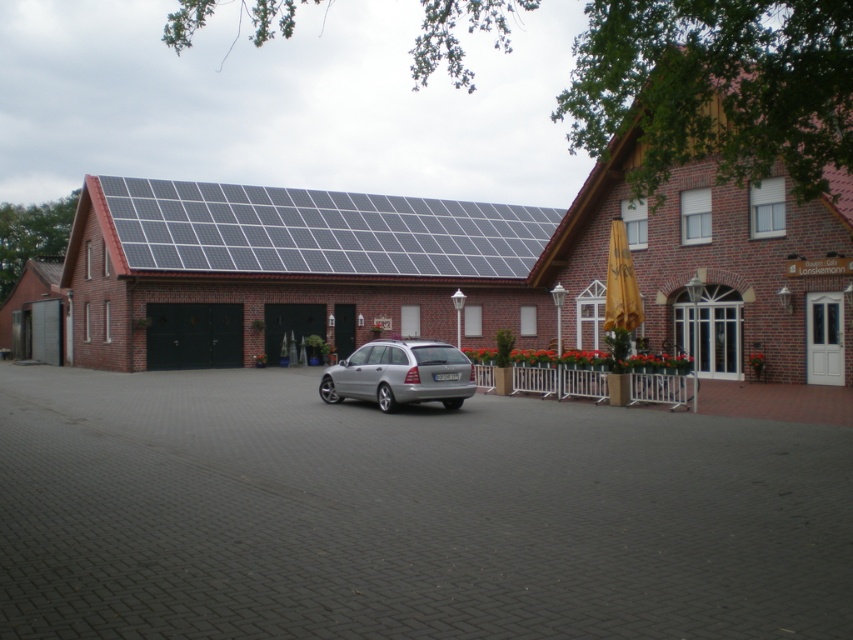
Based on the photo, you are a delivery person with a 2.5 meter wide truck. You need to park your truck on the gray brick driveway at center. There is a silver metallic station wagon at center already parked. Can you park your truck next to the station wagon without moving it?

The gray brick driveway at center and silver metallic station wagon at center are 3.12 meters apart from each other. Since your truck is 2.5 meters wide, there is enough space between the driveway and the station wagon to park your truck next to it without moving the wagon.

You are a delivery person arriving at the Lanskemann restaurant. You need to park your silver metallic station wagon at center in a spot that is on the gray brick driveway at center. Is the driveway below the car currently occupied by another vehicle?

The gray brick driveway at center is below the silver metallic station wagon at center, which means the driveway is currently occupied by the station wagon, so there is no available space for another vehicle.